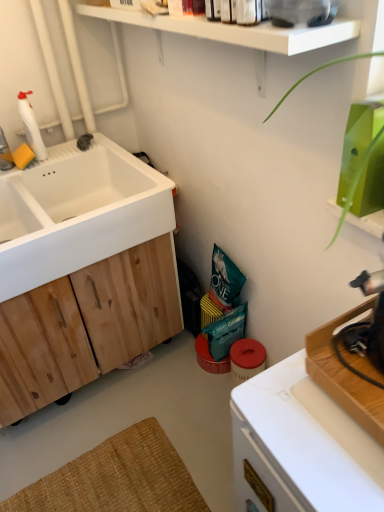
Question: From the image's perspective, is natural wood cabinet at left over white plastic bottle at upper left?

Choices:
 (A) yes
 (B) no

Answer: (B)

Question: Is white plastic bottle at upper left completely or partially inside natural wood cabinet at left?

Choices:
 (A) no
 (B) yes

Answer: (A)

Question: Is natural wood cabinet at left directly adjacent to white plastic bottle at upper left?

Choices:
 (A) yes
 (B) no

Answer: (B)

Question: Does natural wood cabinet at left have a lesser height compared to white plastic bottle at upper left?

Choices:
 (A) no
 (B) yes

Answer: (A)

Question: Is natural wood cabinet at left looking in the opposite direction of white plastic bottle at upper left?

Choices:
 (A) yes
 (B) no

Answer: (B)

Question: Considering the relative sizes of natural wood cabinet at left and white plastic bottle at upper left in the image provided, is natural wood cabinet at left taller than white plastic bottle at upper left?

Choices:
 (A) yes
 (B) no

Answer: (A)

Question: Is white plastic countertop at lower right positioned far away from natural wood cabinet at left?

Choices:
 (A) no
 (B) yes

Answer: (A)

Question: Can you confirm if white plastic countertop at lower right is smaller than natural wood cabinet at left?

Choices:
 (A) yes
 (B) no

Answer: (A)

Question: Is white plastic countertop at lower right thinner than natural wood cabinet at left?

Choices:
 (A) no
 (B) yes

Answer: (B)

Question: From a real-world perspective, is white plastic countertop at lower right positioned under natural wood cabinet at left based on gravity?

Choices:
 (A) yes
 (B) no

Answer: (B)

Question: From the image's perspective, does white plastic countertop at lower right appear lower than natural wood cabinet at left?

Choices:
 (A) yes
 (B) no

Answer: (A)

Question: Is white plastic countertop at lower right at the left side of natural wood cabinet at left?

Choices:
 (A) no
 (B) yes

Answer: (A)

Question: Considering the relative sizes of white plastic bottle at upper left and white matte sink at left in the image provided, is white plastic bottle at upper left smaller than white matte sink at left?

Choices:
 (A) no
 (B) yes

Answer: (B)